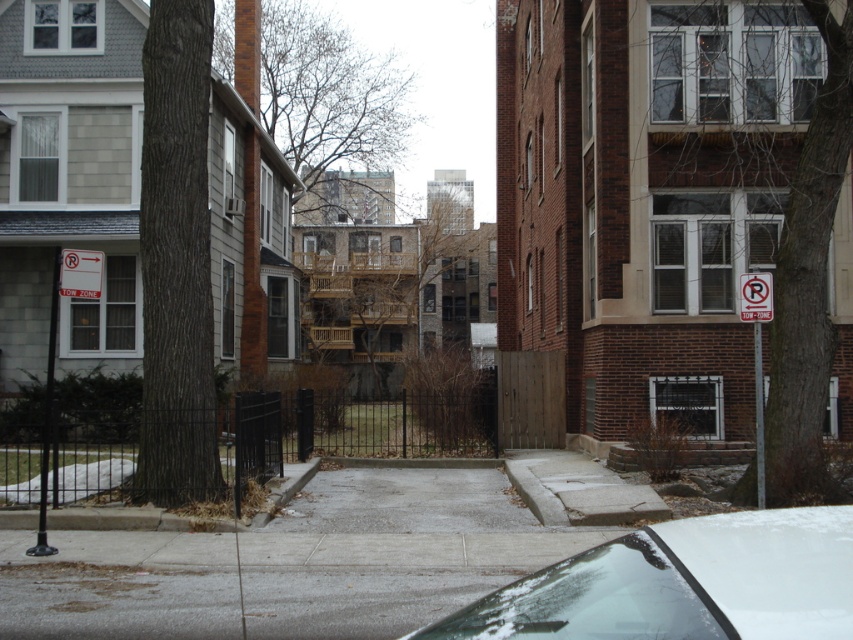
Question: Based on their relative distances, which object is farther from the bare branches at upper center?

Choices:
 (A) brown rough bark tree at left
 (B) brown bark tree at right

Answer: (B)

Question: Does white glossy car at lower right lie in front of bare branches at upper center?

Choices:
 (A) yes
 (B) no

Answer: (A)

Question: Can you confirm if white glossy car at lower right is wider than brown bark tree at right?

Choices:
 (A) yes
 (B) no

Answer: (A)

Question: Does white glossy car at lower right appear under brown wooden tree at center?

Choices:
 (A) no
 (B) yes

Answer: (B)

Question: Which object is the farthest from the brown rough bark tree at left?

Choices:
 (A) white plastic sign at right
 (B) gray concrete pavement at center

Answer: (A)

Question: Which point appears closest to the camera in this image?

Choices:
 (A) (761, 301)
 (B) (819, 33)
 (C) (183, 412)

Answer: (A)